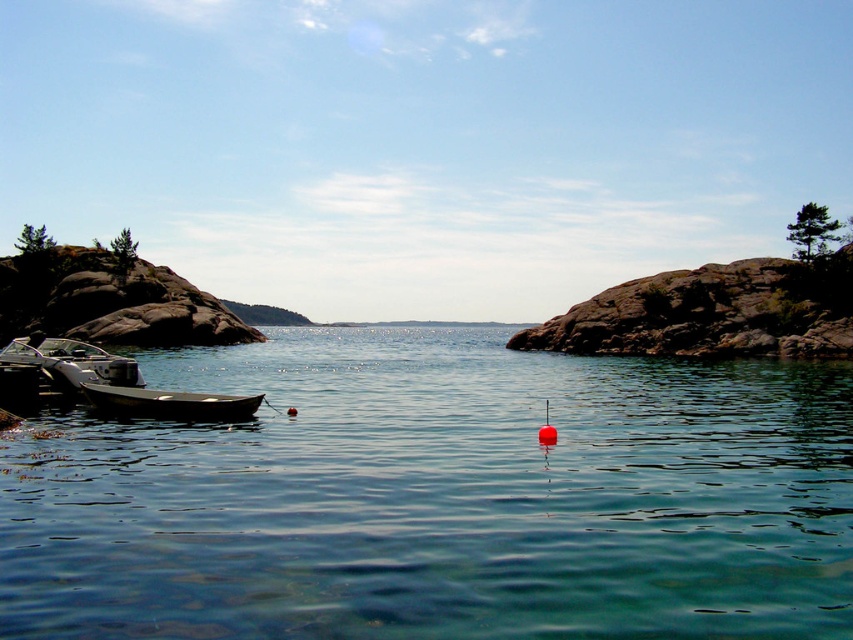
Question: Considering the relative positions of metallic gray boat at left and smooth dark wood canoe at left in the image provided, where is metallic gray boat at left located with respect to smooth dark wood canoe at left?

Choices:
 (A) below
 (B) above

Answer: (B)

Question: Which point appears farthest from the camera in this image?

Choices:
 (A) coord(486,589)
 (B) coord(30,392)
 (C) coord(190,412)

Answer: (B)

Question: Considering the relative positions of metallic gray boat at left and smooth dark wood canoe at left in the image provided, where is metallic gray boat at left located with respect to smooth dark wood canoe at left?

Choices:
 (A) below
 (B) above

Answer: (B)

Question: Which point is farther to the camera?

Choices:
 (A) smooth dark wood canoe at left
 (B) clear water at center
 (C) metallic gray boat at left

Answer: (C)

Question: Which point is closer to the camera?

Choices:
 (A) (131, 413)
 (B) (630, 506)

Answer: (B)

Question: Can you confirm if clear water at center is wider than smooth dark wood canoe at left?

Choices:
 (A) yes
 (B) no

Answer: (A)